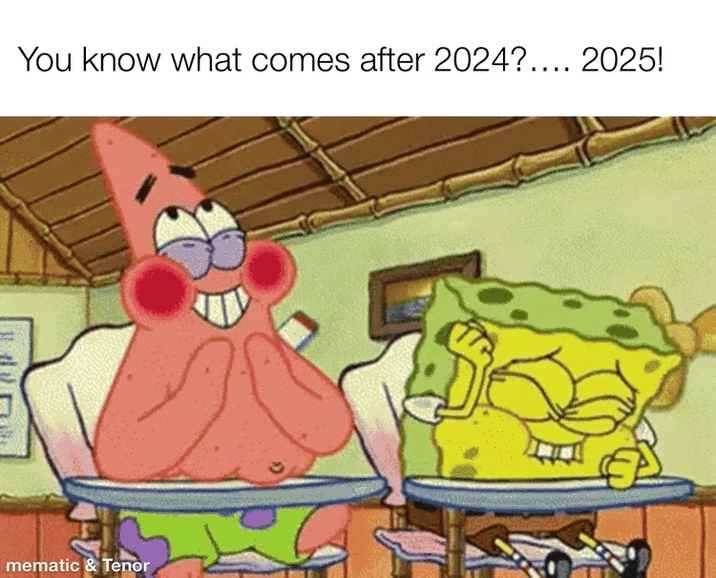
Locate an element on the screen. This screenshot has height=578, width=716. hung picture is located at coordinates (414, 300).